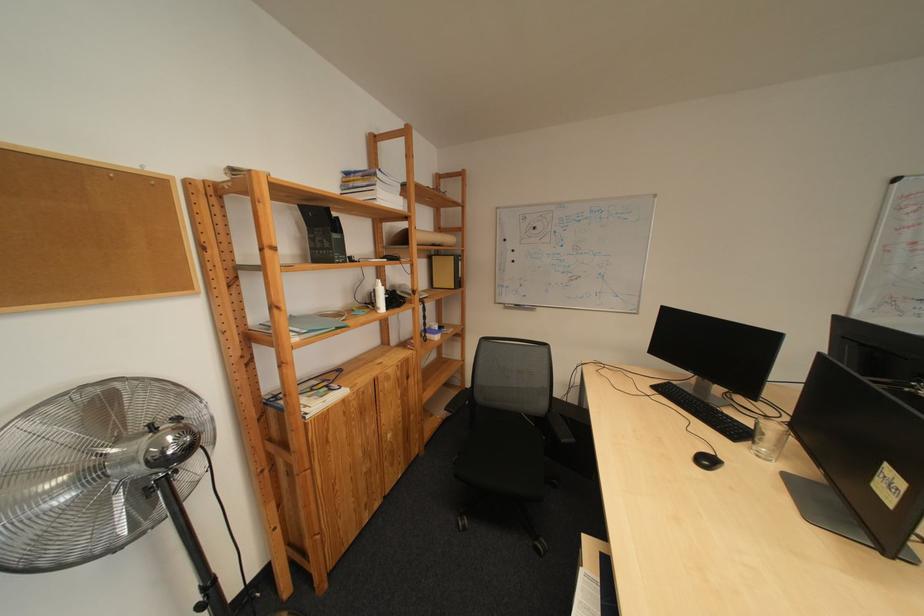
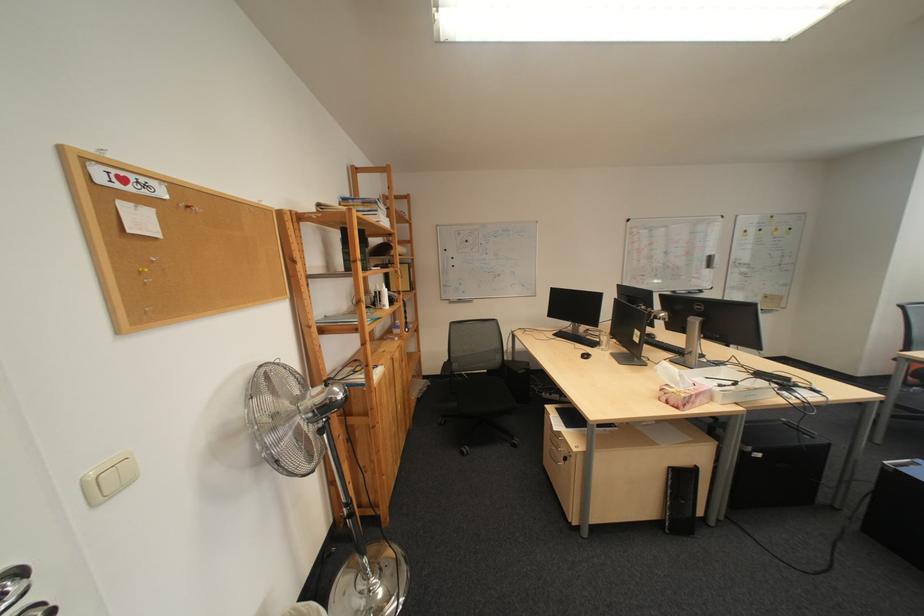
Where in the second image is the point corresponding to (x=667, y=389) from the first image?

(568, 336)